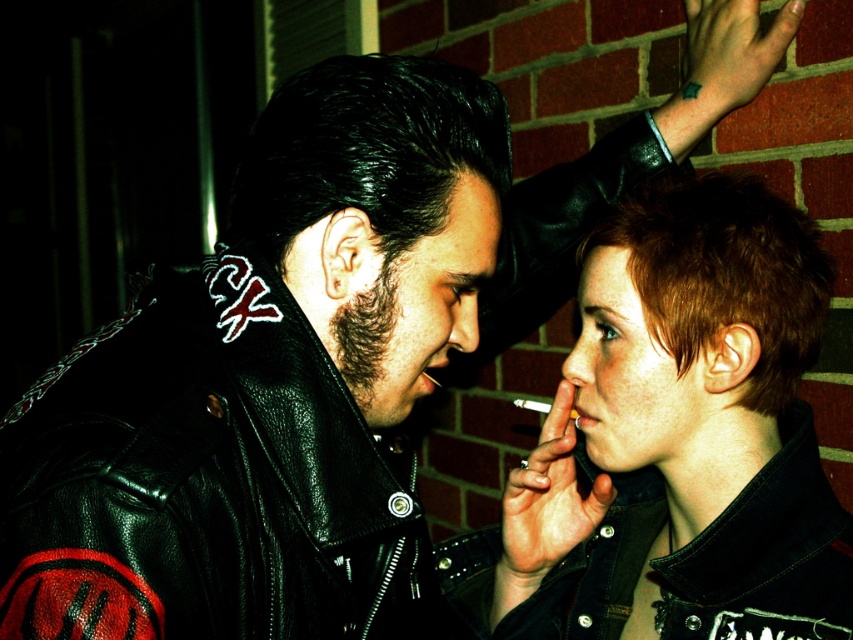
You are a tailor who needs to determine which jacket to alter first. The denim jacket at center and the black leather jacket at upper left are both in need of adjustments. If you can only work on the wider jacket first, which one should you prioritize?

The denim jacket at center is wider than the black leather jacket at upper left, so you should prioritize altering the denim jacket at center first.